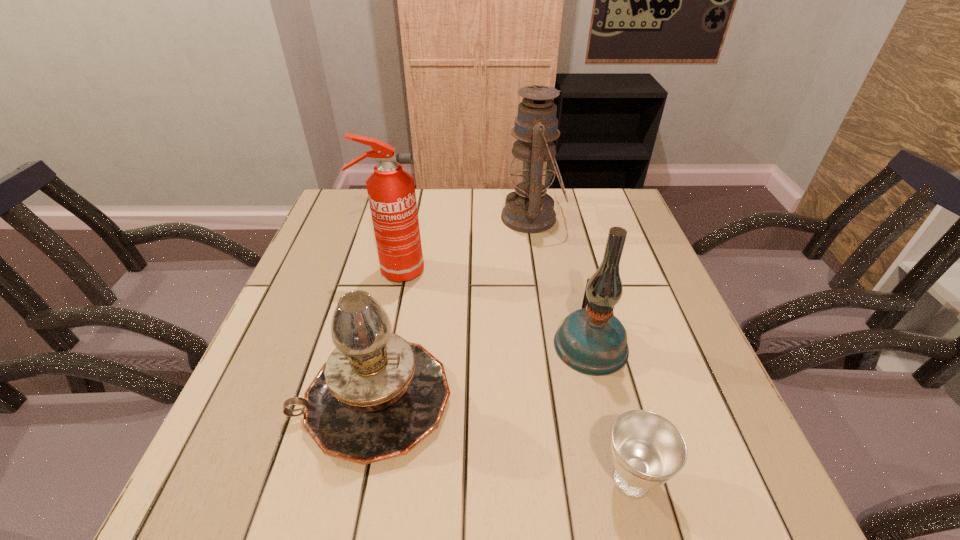
Locate an element on the screen. This screenshot has width=960, height=540. oil lamp that is at the near edge is located at coordinates (377, 397).

Image resolution: width=960 pixels, height=540 pixels. Identify the location of chalice that is at the near edge. point(647,450).

You are a GUI agent. You are given a task and a screenshot of the screen. Output one action in this format:
    pyautogui.click(x=<x>, y=<y>)
    Task: Click on the fire extinguisher situated at the left edge
    The width and height of the screenshot is (960, 540).
    Given the screenshot: What is the action you would take?
    pyautogui.click(x=391, y=191)

The image size is (960, 540). Find the location of `oil lamp that is at the left edge`. oil lamp that is at the left edge is located at coordinates (377, 397).

You are a GUI agent. You are given a task and a screenshot of the screen. Output one action in this format:
    pyautogui.click(x=<x>, y=<y>)
    Task: Click on the oil lamp that is at the right edge
    The width and height of the screenshot is (960, 540).
    Given the screenshot: What is the action you would take?
    pyautogui.click(x=591, y=340)

The height and width of the screenshot is (540, 960). Identify the location of chalice that is at the right edge. (647, 450).

Locate an element on the screen. This screenshot has width=960, height=540. object that is at the near left corner is located at coordinates (377, 397).

The height and width of the screenshot is (540, 960). What are the coordinates of `object that is at the near right corner` in the screenshot? It's located at (647, 450).

In the image, there is a desktop. At what (x,y) coordinates should I click in order to perform the action: click on vacant space at the far edge. Please return your answer as a coordinate pair (x, y). Looking at the image, I should click on (564, 208).

In the image, there is a desktop. Find the location of `vacant space at the near edge`. vacant space at the near edge is located at coordinates (329, 472).